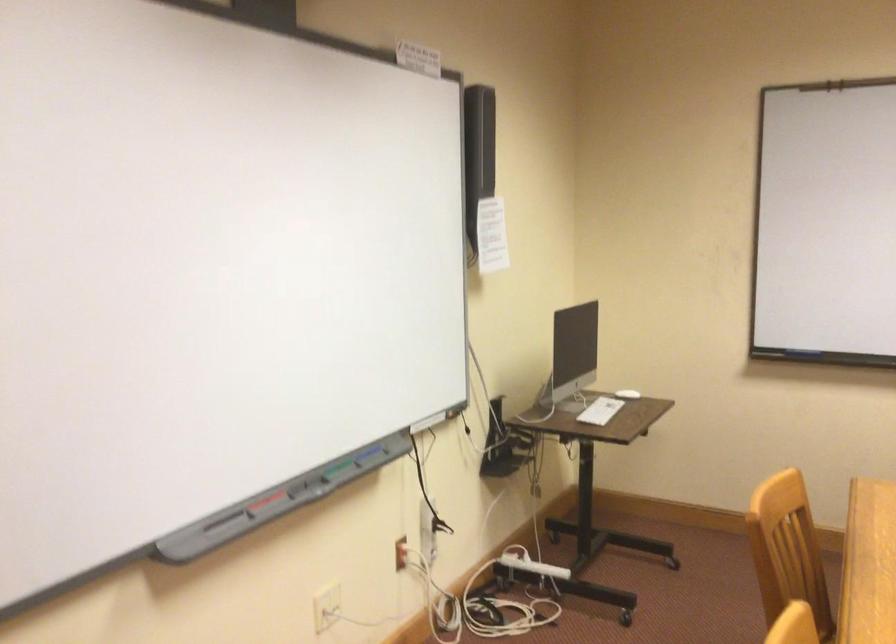
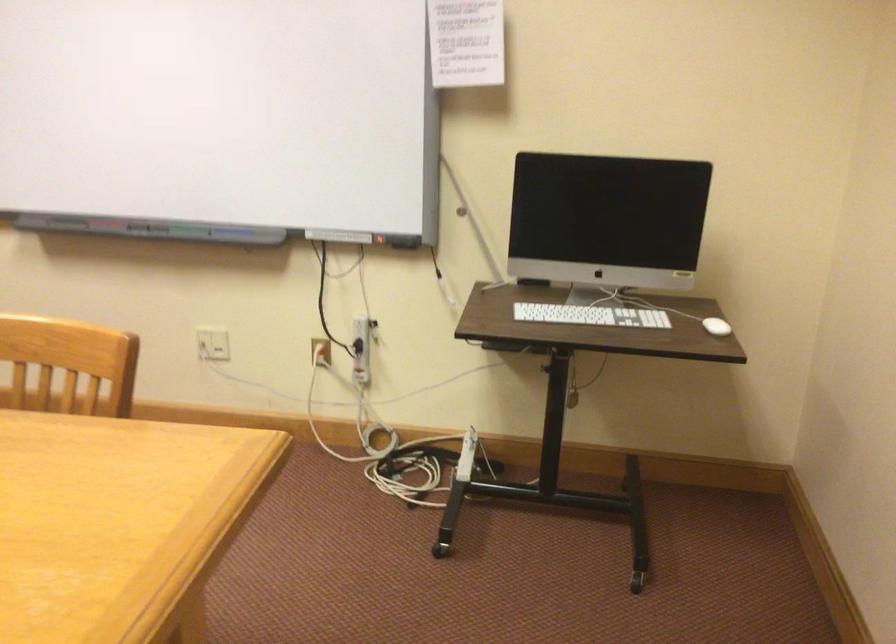
In the second image, find the point that corresponds to point (612, 406) in the first image.

(590, 315)